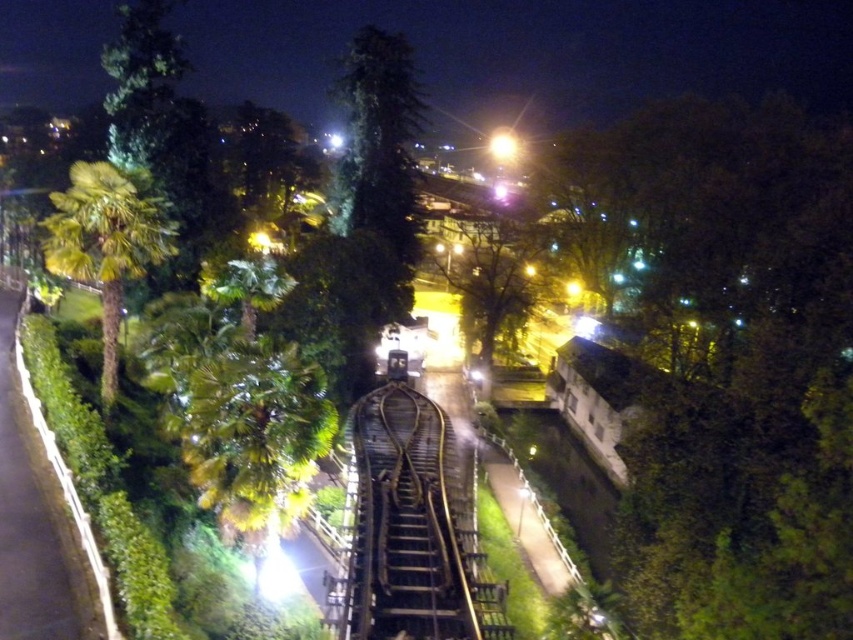
You are a delivery person who needs to place a package that is 11 meters long between the wooden at center and the green leafy palm tree at left. Can you fit the package between them without bending it?

The wooden at center is 10.75 meters from the green leafy palm tree at left, so the package cannot be placed between them without bending it since it is longer than the distance available.

You are standing at the point marked as point [407,525] in the image, which is located at the center of the scene. According to the scene description, what material can you see around you?

The point [407,525] indicates wooden at center, so you can see wooden material around you.